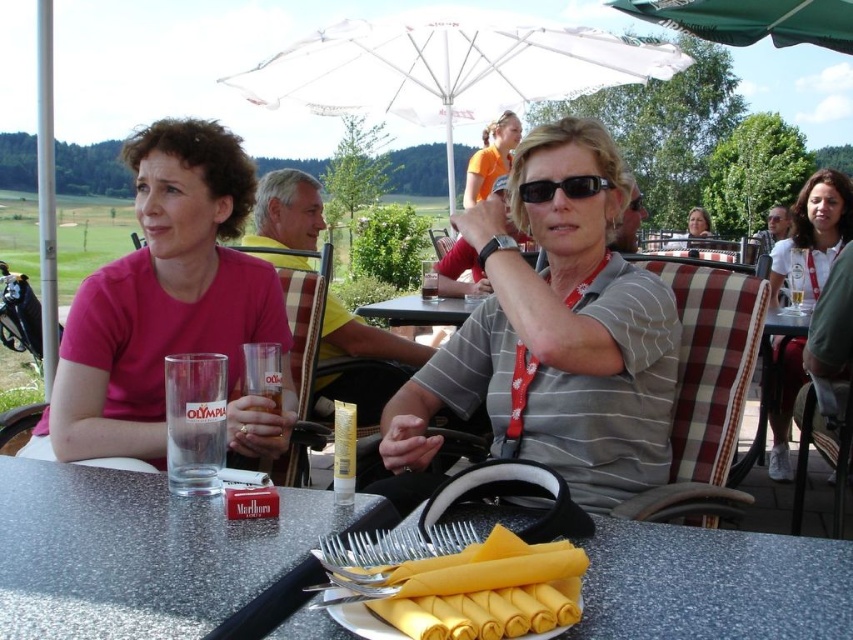
Who is lower down, matte pink shirt at left or white lanyard at upper right?

white lanyard at upper right is lower down.

Is matte pink shirt at left positioned at the back of white lanyard at upper right?

That is False.

The width and height of the screenshot is (853, 640). I want to click on matte pink shirt at left, so click(x=170, y=307).

Identify the location of matte pink shirt at left. The image size is (853, 640). (170, 307).

Does black plastic table at center come behind translucent glass at table left?

Yes.

Is black plastic table at center bigger than translucent glass at table left?

Correct, black plastic table at center is larger in size than translucent glass at table left.

Is point (401, 321) positioned after point (270, 388)?

That is True.

Identify the location of black plastic table at center. pos(418,310).

Does point (169, 540) lie behind point (422, 19)?

No.

Can you confirm if speckled laminate table at center is positioned below white fabric umbrella at upper center?

Indeed, speckled laminate table at center is positioned under white fabric umbrella at upper center.

Between point (254, 564) and point (373, 74), which one is positioned in front?

Point (254, 564) is in front.

Where is `speckled laminate table at center`? The height and width of the screenshot is (640, 853). speckled laminate table at center is located at coordinates (152, 556).